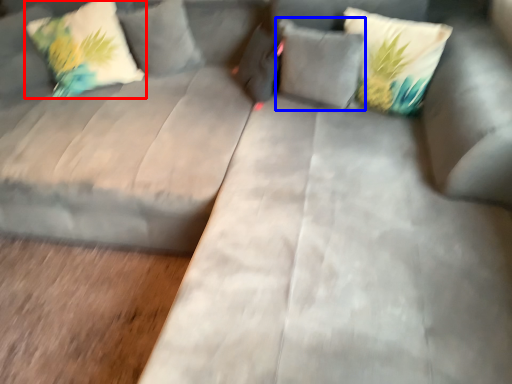
Question: Among these objects, which one is nearest to the camera, pillow (highlighted by a red box) or pillow (highlighted by a blue box)?

Choices:
 (A) pillow
 (B) pillow

Answer: (B)